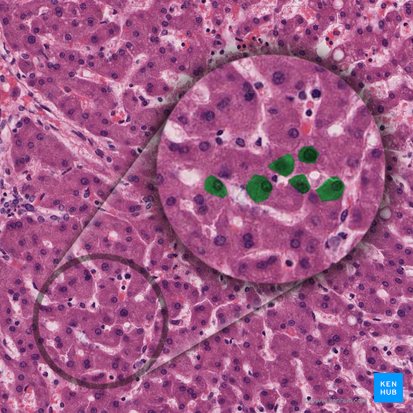
This screenshot has width=413, height=413. I want to click on box, so click(x=388, y=388).